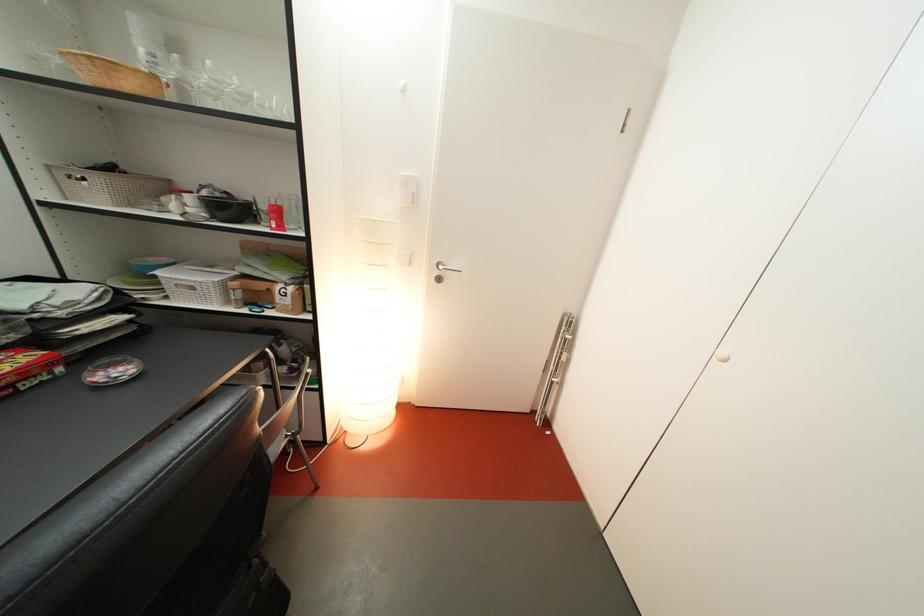
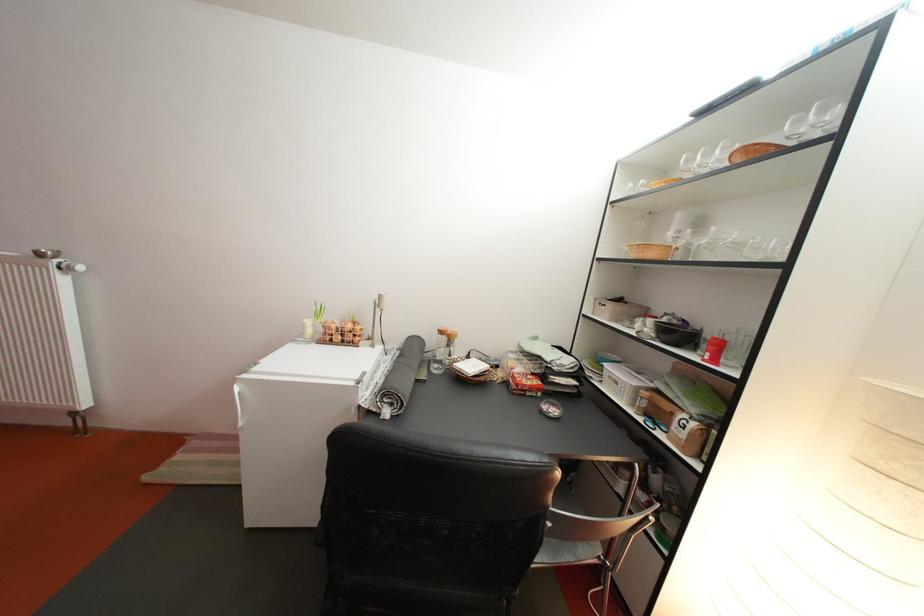
Find the pixel in the second image that matches pixel 247 291 in the first image.

(658, 400)